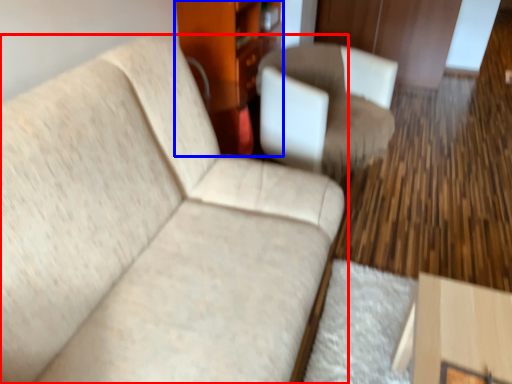
Question: Which object appears closest to the camera in this image, studio couch (highlighted by a red box) or dresser (highlighted by a blue box)?

Choices:
 (A) studio couch
 (B) dresser

Answer: (A)